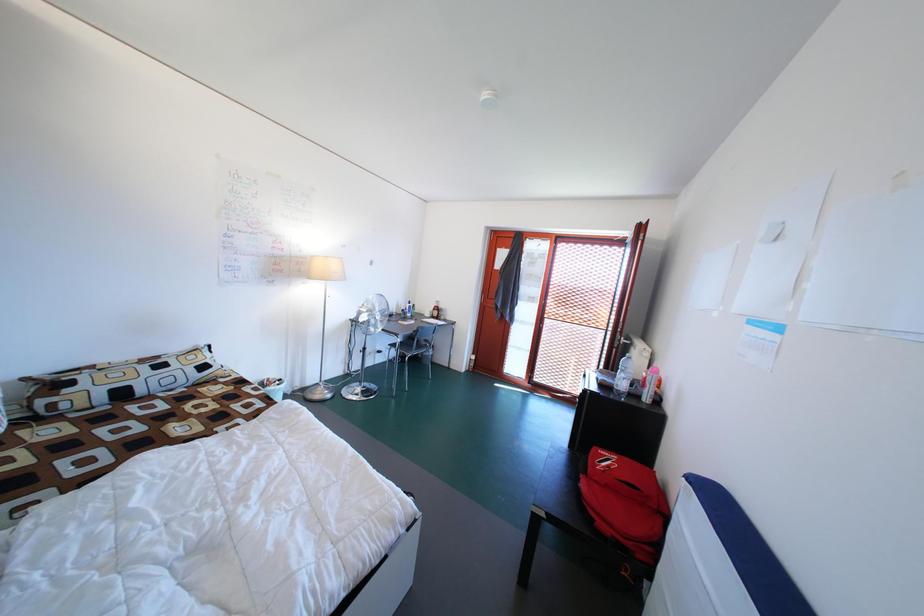
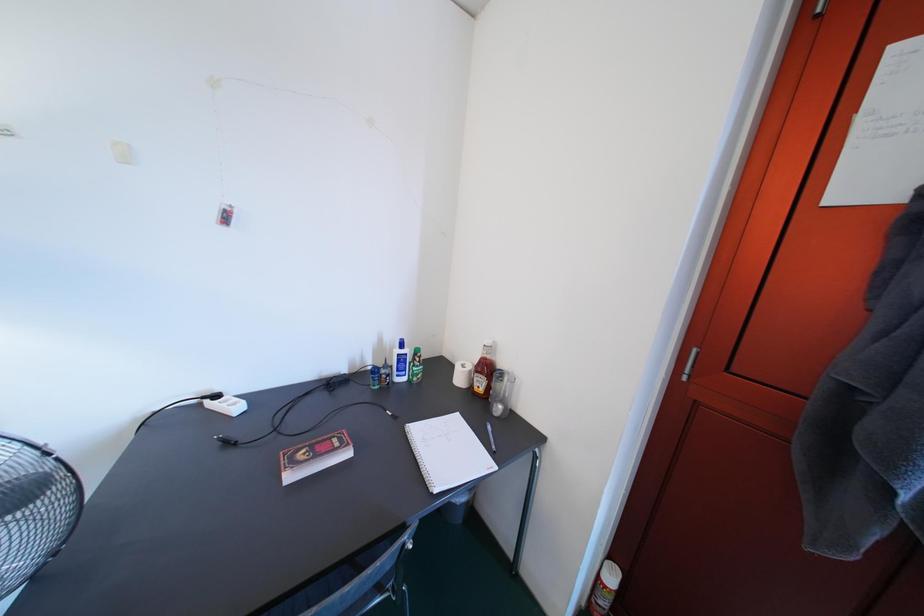
Question: What movement of the cameraman would produce the second image?

Choices:
 (A) Left
 (B) Right
 (C) Forward
 (D) Backward

Answer: (C)